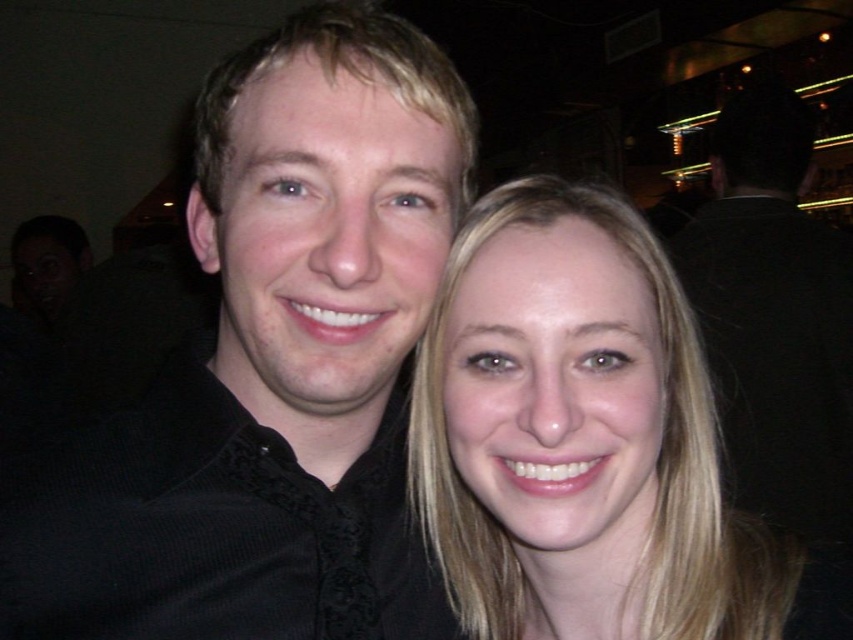
Which of these two, black textured shirt at center or blonde hair at center, stands taller?

black textured shirt at center

How much distance is there between black textured shirt at center and blonde hair at center?

They are 4.49 inches apart.

Is point (21, 500) behind point (703, 460)?

That is False.

You are a GUI agent. You are given a task and a screenshot of the screen. Output one action in this format:
    pyautogui.click(x=<x>, y=<y>)
    Task: Click on the black textured shirt at center
    This screenshot has height=640, width=853.
    Given the screenshot: What is the action you would take?
    pyautogui.click(x=271, y=369)